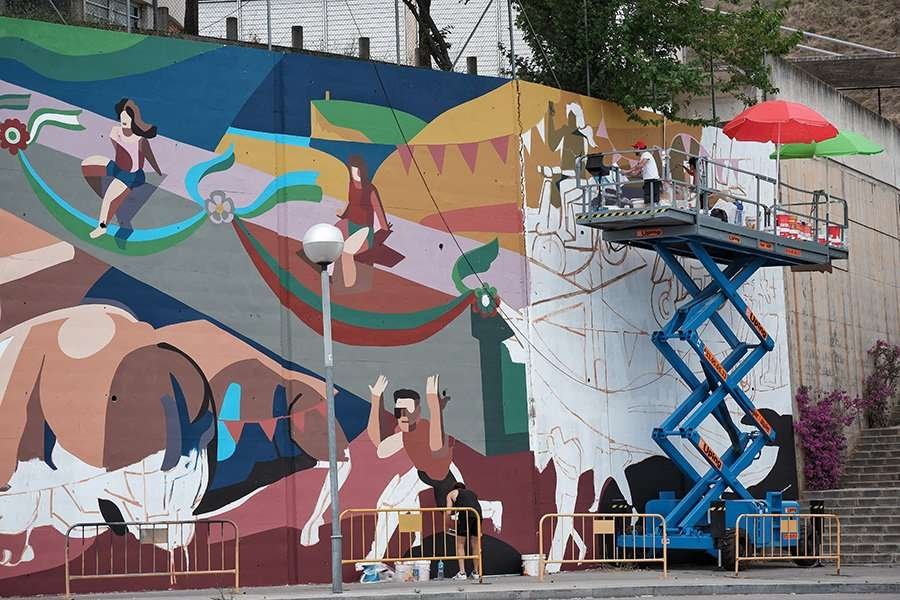
Image resolution: width=900 pixels, height=600 pixels. Identify the location of lightbulb. (326, 249).